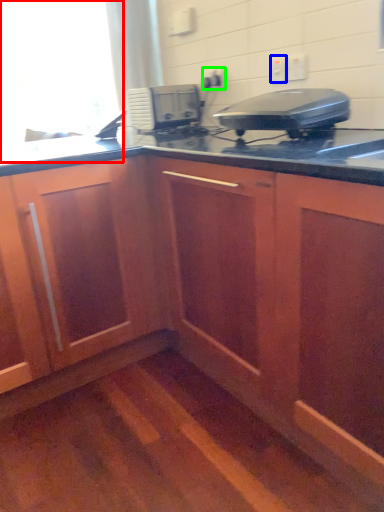
Question: Which is nearer to the window screen (highlighted by a red box)? electric outlet (highlighted by a blue box) or electric outlet (highlighted by a green box).

Choices:
 (A) electric outlet
 (B) electric outlet

Answer: (B)